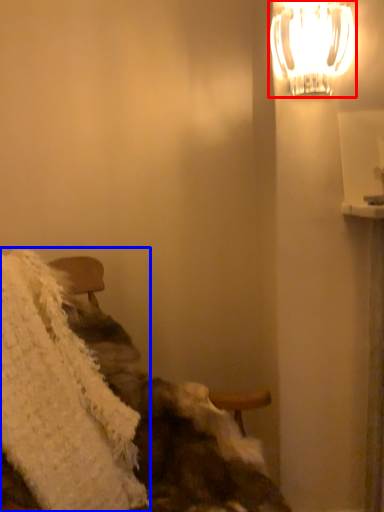
Question: Which point is closer to the camera, lamp (highlighted by a red box) or blanket (highlighted by a blue box)?

Choices:
 (A) lamp
 (B) blanket

Answer: (B)